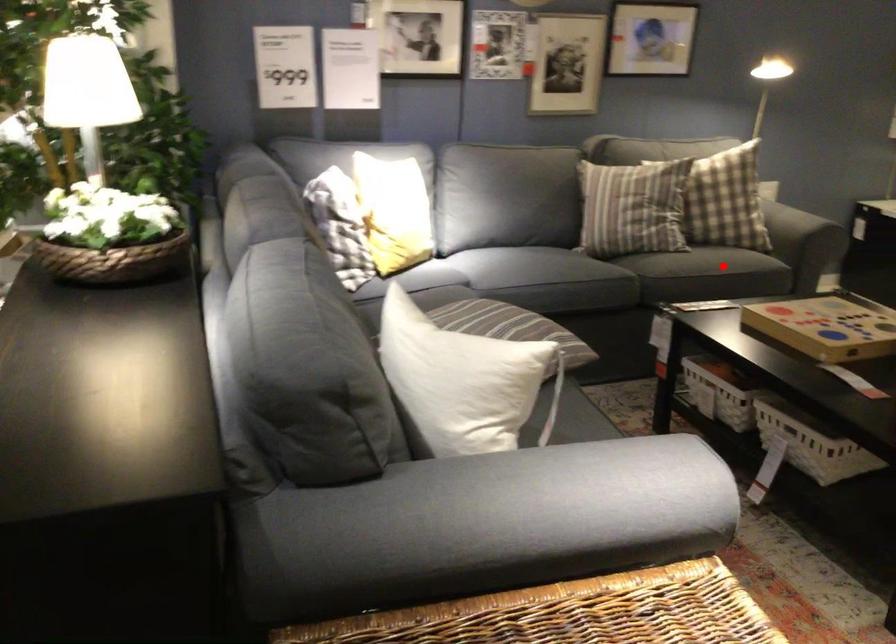
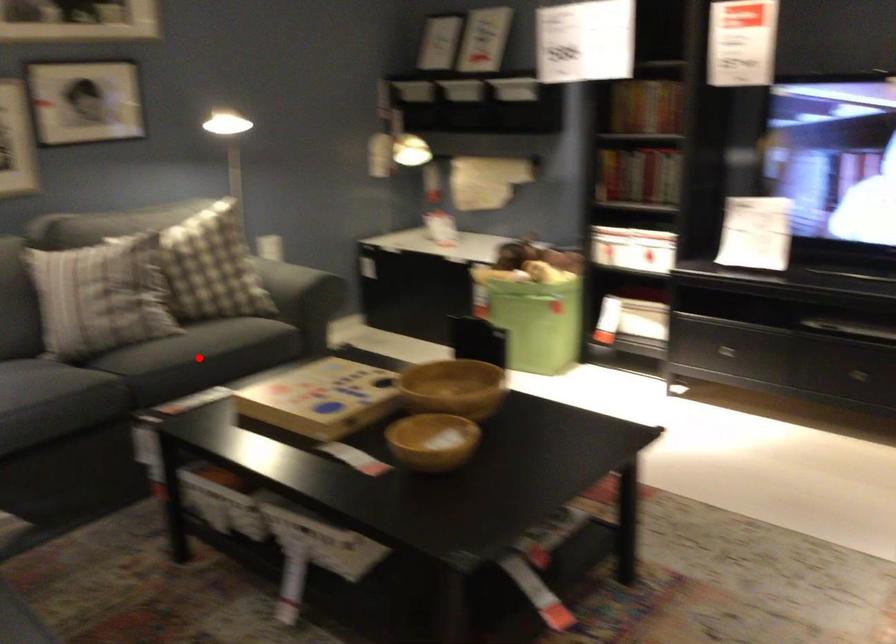
I am providing you with two images of the same scene from different viewpoints. A red point is marked on the first image and another point is marked on the second image. Are the points marked in image1 and image2 representing the same 3D position?

Yes